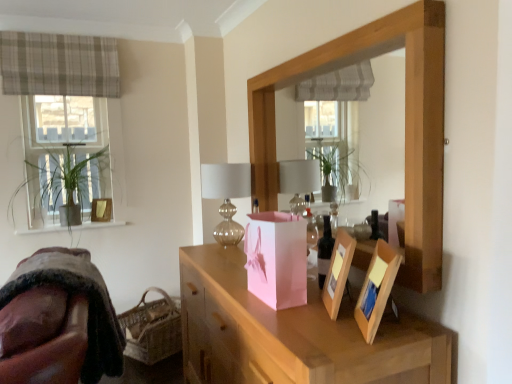
Where is `vacant area on top of plaid fabric curtain at upper left (from a real-world perspective)`? The image size is (512, 384). vacant area on top of plaid fabric curtain at upper left (from a real-world perspective) is located at coordinates (59, 36).